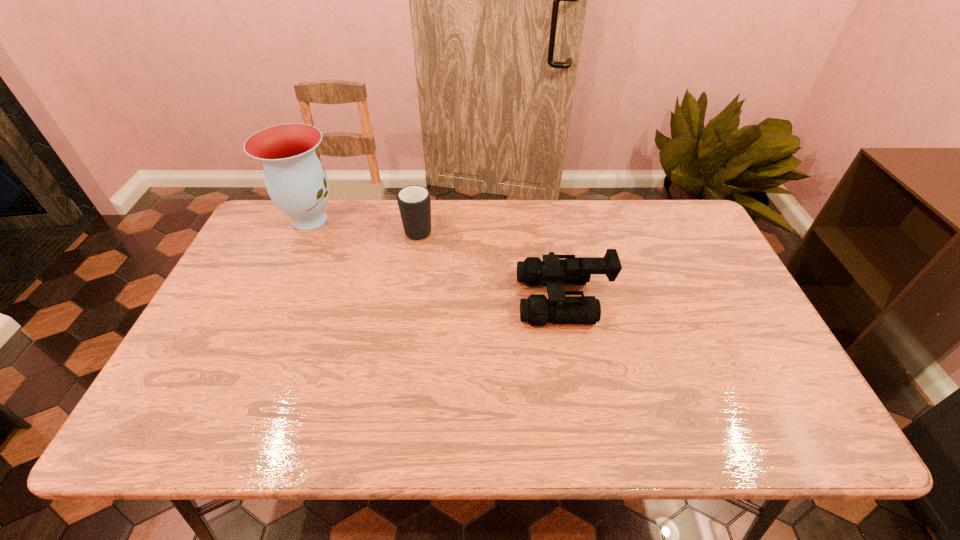
At what (x,y) coordinates should I click in order to perform the action: click on vacant space that is in between the tallest object and the rightmost object. Please return your answer as a coordinate pair (x, y). Looking at the image, I should click on (436, 259).

At what (x,y) coordinates should I click in order to perform the action: click on vacant region between the mug and the rightmost object. Please return your answer as a coordinate pair (x, y). The height and width of the screenshot is (540, 960). Looking at the image, I should click on (491, 264).

I want to click on vacant area that lies between the rightmost object and the second object from right to left, so [491, 264].

Locate an element on the screen. vacant space that is in between the nearest object and the second object from right to left is located at coordinates (491, 264).

In order to click on free space that is in between the mug and the nearest object in this screenshot , I will do `click(491, 264)`.

Where is `free space between the tallest object and the mug`? The height and width of the screenshot is (540, 960). free space between the tallest object and the mug is located at coordinates (364, 224).

Locate an element on the screen. Image resolution: width=960 pixels, height=540 pixels. free space that is in between the leftmost object and the second object from right to left is located at coordinates (364, 224).

At what (x,y) coordinates should I click in order to perform the action: click on vacant area that lies between the binoculars and the tallest object. Please return your answer as a coordinate pair (x, y). Looking at the image, I should click on (436, 259).

Identify which object is located as the second nearest to the second object from left to right. Please provide its 2D coordinates. Your answer should be formatted as a tuple, i.e. [(x, y)], where the tuple contains the x and y coordinates of a point satisfying the conditions above.

[(555, 270)]

The width and height of the screenshot is (960, 540). Find the location of `object that is the second closest to the nearest object`. object that is the second closest to the nearest object is located at coordinates (296, 181).